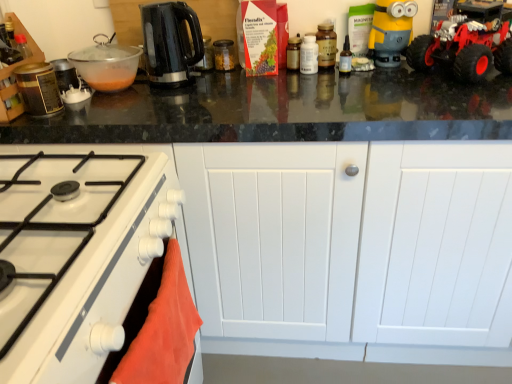
Question: In the image, is red rubber toy car at upper right positioned in front of or behind yellow matte minion toy at upper right?

Choices:
 (A) behind
 (B) front

Answer: (B)

Question: Is red rubber toy car at upper right inside the boundaries of yellow matte minion toy at upper right, or outside?

Choices:
 (A) inside
 (B) outside

Answer: (B)

Question: Estimate the real-world distances between objects in this image. Which object is farther from the transparent glass jar at center, which is counted as the 4th kitchen appliance, starting from the left?

Choices:
 (A) yellow matte minion toy at upper right
 (B) black glossy electric kettle at upper center, arranged as the third kitchen appliance when viewed from the left
 (C) white glossy bottle at center, the 2th kitchen appliance in the right-to-left sequence
 (D) metallic canister at left, which is the first kitchen appliance in left-to-right order
 (E) white glossy gas stove at lower left

Answer: (E)

Question: Which of these objects is positioned closest to the transparent plastic bottle at center?

Choices:
 (A) transparent plastic bowl at upper left, which ranks as the sixth kitchen appliance in right-to-left order
 (B) orange fabric towel at lower left
 (C) red rubber toy car at upper right
 (D) metallic canister at left, which ranks as the 7th kitchen appliance in right-to-left order
 (E) yellow matte minion toy at upper right

Answer: (E)